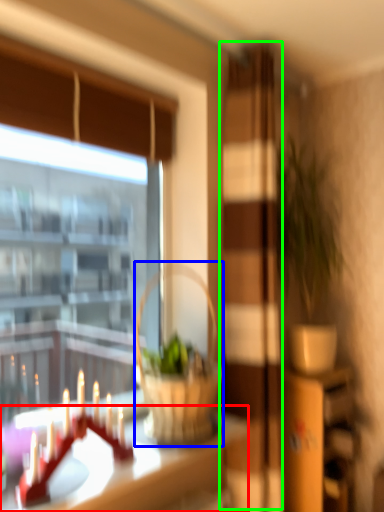
Question: Estimate the real-world distances between objects in this image. Which object is closer to table (highlighted by a red box), picnic basket (highlighted by a blue box) or screen door (highlighted by a green box)?

Choices:
 (A) picnic basket
 (B) screen door

Answer: (A)